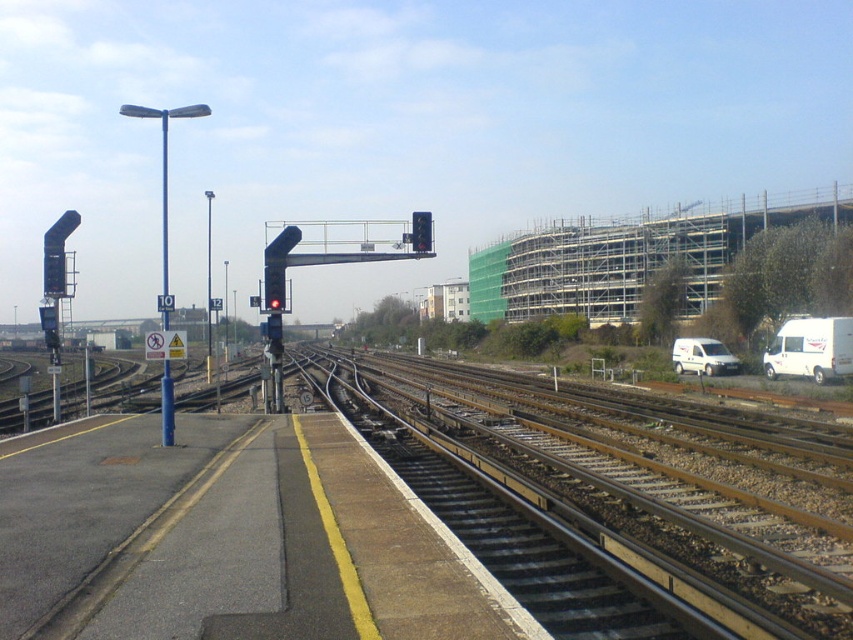
Question: Does blue metallic pole at center have a larger size compared to black plastic traffic light at left?

Choices:
 (A) no
 (B) yes

Answer: (B)

Question: Which of the following is the closest to the observer?

Choices:
 (A) (416, 225)
 (B) (161, 237)
 (C) (795, 488)
 (D) (71, 214)

Answer: (C)

Question: Estimate the real-world distances between objects in this image. Which object is farther from the blue metallic pole at center?

Choices:
 (A) metal/smooth train track at center
 (B) metallic traffic light at center
 (C) black plastic traffic light at left

Answer: (B)

Question: Does metal/smooth train track at center appear over metallic traffic light at center?

Choices:
 (A) yes
 (B) no

Answer: (B)

Question: Which point appears closest to the camera in this image?

Choices:
 (A) (47, 289)
 (B) (419, 241)

Answer: (A)

Question: Considering the relative positions of blue metallic pole at center and black plastic traffic light at left in the image provided, where is blue metallic pole at center located with respect to black plastic traffic light at left?

Choices:
 (A) below
 (B) above

Answer: (A)